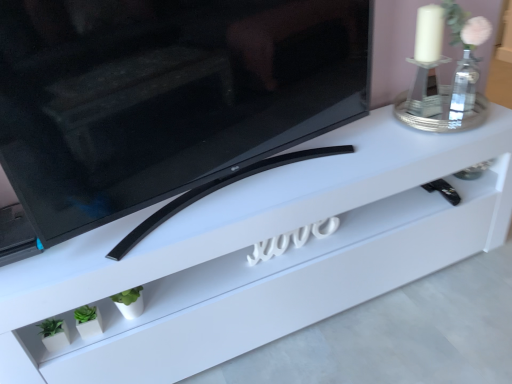
Question: Considering the positions of white matte planter at lower left and black glossy tv at center in the image, is white matte planter at lower left taller or shorter than black glossy tv at center?

Choices:
 (A) short
 (B) tall

Answer: (A)

Question: Based on their sizes in the image, would you say white matte planter at lower left is bigger or smaller than black glossy tv at center?

Choices:
 (A) big
 (B) small

Answer: (B)

Question: Based on their relative distances, which object is nearer to the white glossy tv stand at center?

Choices:
 (A) white matte planter at lower left
 (B) white glass candle holder at upper right
 (C) black glossy tv at center

Answer: (C)

Question: Which is farther from the white matte planter at lower left?

Choices:
 (A) black glossy tv at center
 (B) white glass candle holder at upper right
 (C) white glossy tv stand at center

Answer: (B)